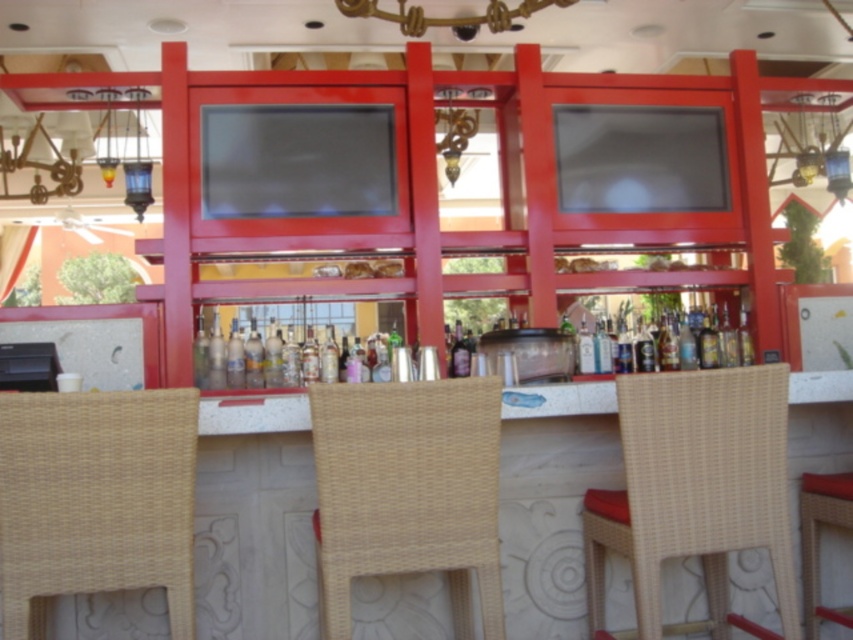
Question: Among these objects, which one is farthest from the camera?

Choices:
 (A) translucent glass bottle at center
 (B) woven beige chair at lower left
 (C) woven rattan bar stool at lower right

Answer: (A)

Question: Does woven rattan chair at center have a greater width compared to translucent glass bottle at center?

Choices:
 (A) no
 (B) yes

Answer: (B)

Question: Which of the following is the closest to the observer?

Choices:
 (A) translucent glass bottle at center
 (B) woven beige chair at center
 (C) woven rattan bar stool at lower right

Answer: (B)

Question: Can you confirm if woven rattan chair at center is wider than woven rattan bar stool at lower right?

Choices:
 (A) no
 (B) yes

Answer: (B)

Question: Which point is farther from the camera taking this photo?

Choices:
 (A) (636, 440)
 (B) (816, 627)
 (C) (450, 584)

Answer: (B)

Question: Can you confirm if woven beige chair at lower left is positioned above woven rattan bar stool at lower right?

Choices:
 (A) no
 (B) yes

Answer: (B)